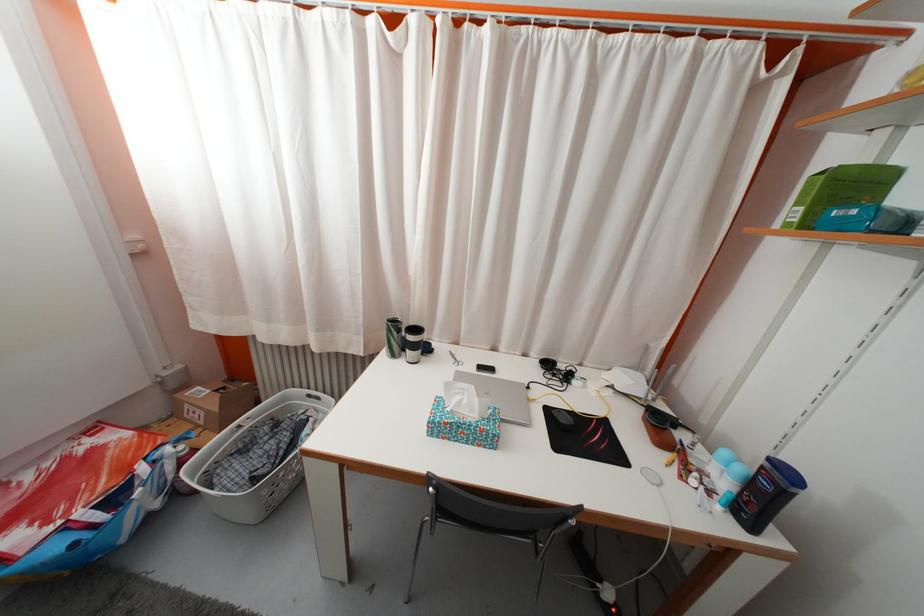
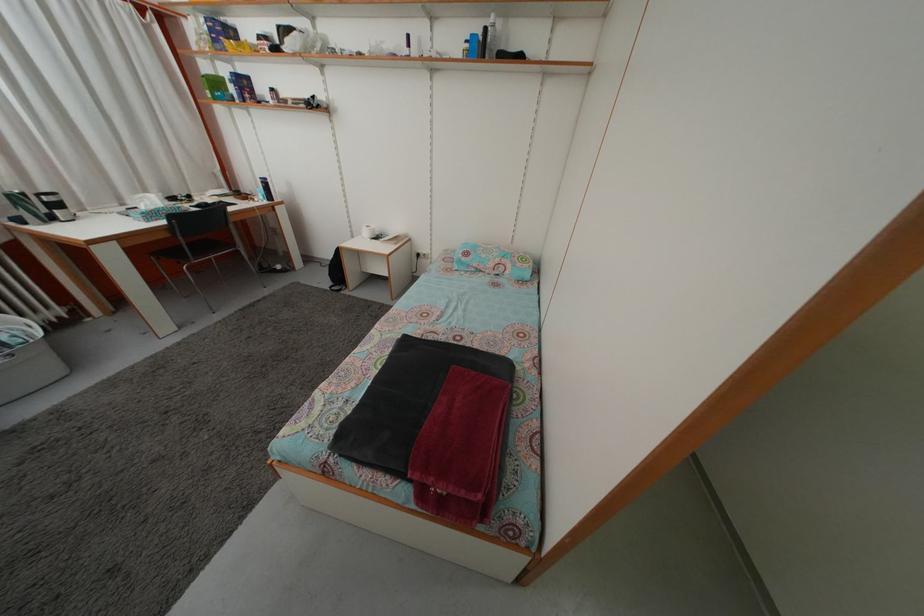
In the second image, find the point that corresponds to the point at 500,355 in the first image.

(128, 213)